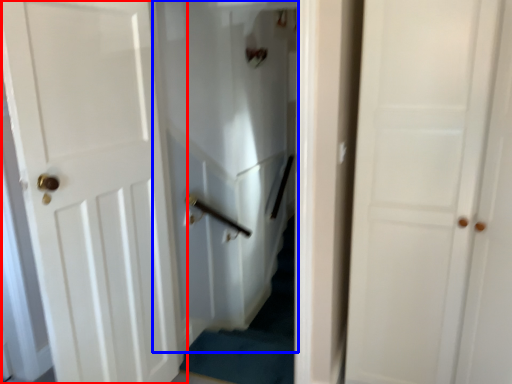
Question: Which point is further to the camera, door (highlighted by a red box) or elevator (highlighted by a blue box)?

Choices:
 (A) door
 (B) elevator

Answer: (B)